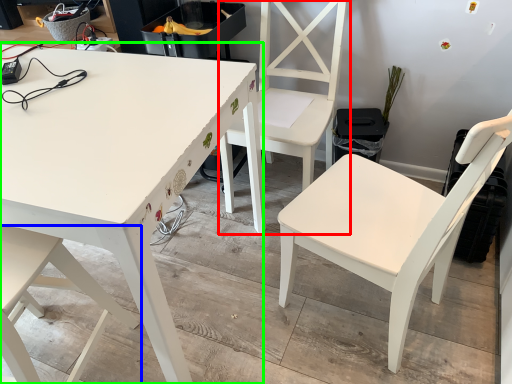
Question: Estimate the real-world distances between objects in this image. Which object is closer to chair (highlighted by a red box), chair (highlighted by a blue box) or table (highlighted by a green box)?

Choices:
 (A) chair
 (B) table

Answer: (B)